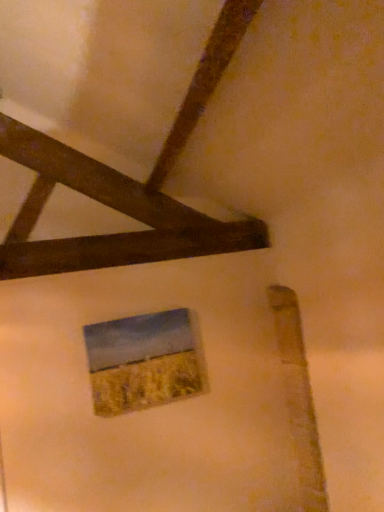
Measure the distance between wooden textured frame at lower center and camera.

wooden textured frame at lower center and camera are 6.49 feet apart.

The image size is (384, 512). What do you see at coordinates (145, 361) in the screenshot? I see `wooden textured frame at lower center` at bounding box center [145, 361].

Identify the location of wooden textured frame at lower center. The height and width of the screenshot is (512, 384). (145, 361).

This screenshot has width=384, height=512. What are the coordinates of `wooden textured frame at lower center` in the screenshot? It's located at (145, 361).